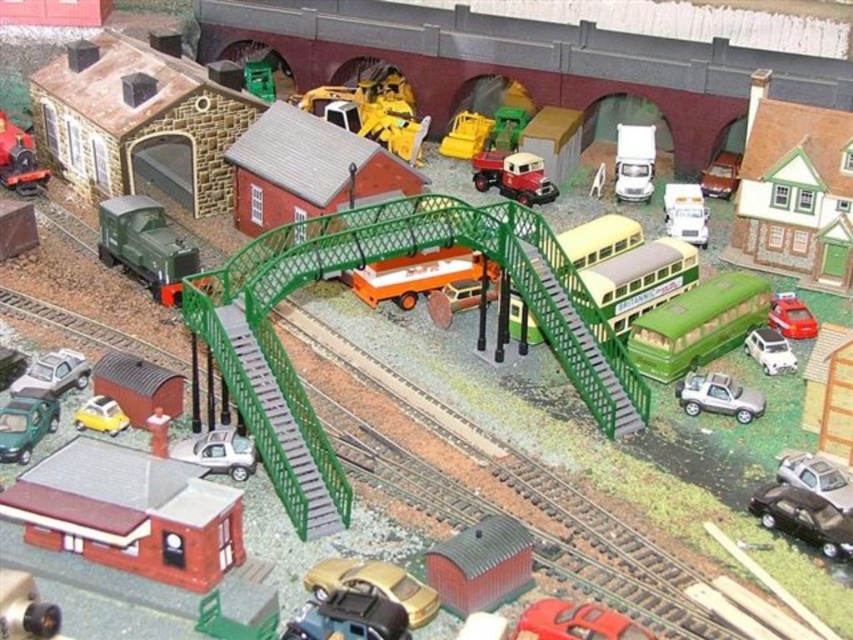
Question: Can you confirm if metallic green car at lower left is bigger than matte silver car at lower left?

Choices:
 (A) no
 (B) yes

Answer: (A)

Question: Is satin silver suv at lower right smaller than satin silver car at lower right?

Choices:
 (A) no
 (B) yes

Answer: (A)

Question: Which of the following is the farthest from the observer?

Choices:
 (A) satin silver car at lower right
 (B) brown matte train car at lower left

Answer: (B)

Question: Which object is closer to the camera taking this photo?

Choices:
 (A) satin silver suv at lower right
 (B) metallic yellow excavator at center

Answer: (A)

Question: Is metallic red barn at center further to camera compared to satin silver car at lower right?

Choices:
 (A) yes
 (B) no

Answer: (B)

Question: Which of the following is the farthest from the observer?

Choices:
 (A) (30, 442)
 (B) (108, 422)
 (C) (579, 621)

Answer: (B)